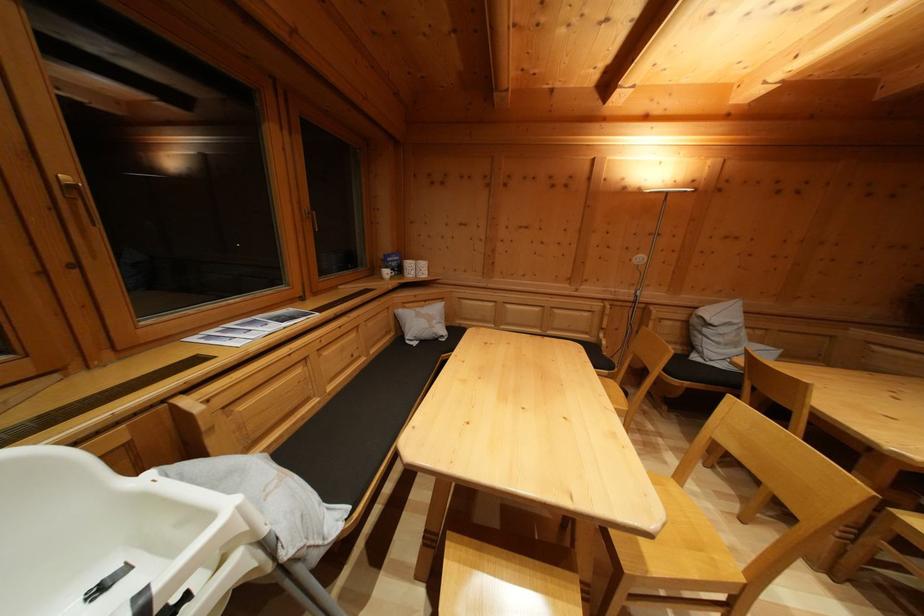
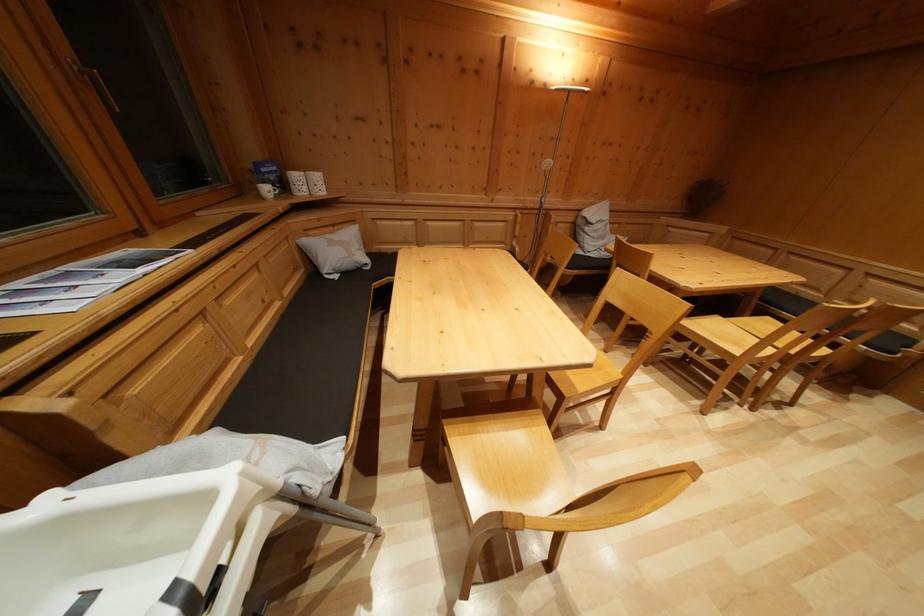
Find the pixel in the second image that matches pixel 156 480 in the first image.

(56, 503)